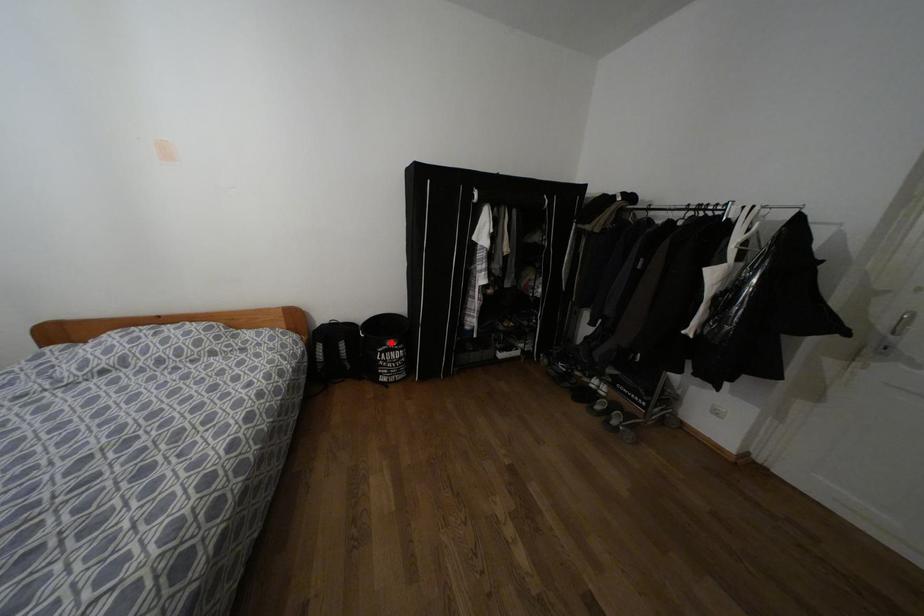
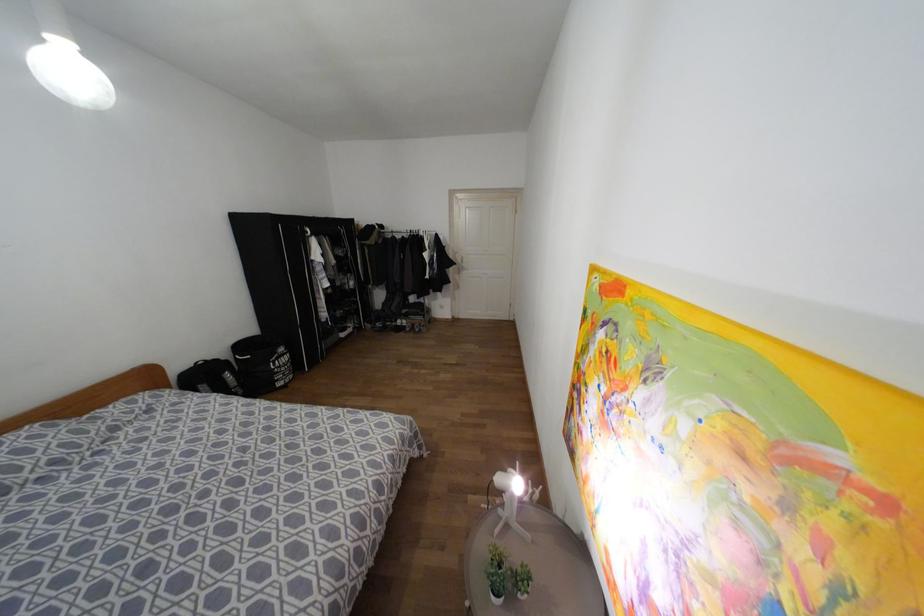
Find the pixel in the second image that matches the highlighted location in the first image.

(281, 349)